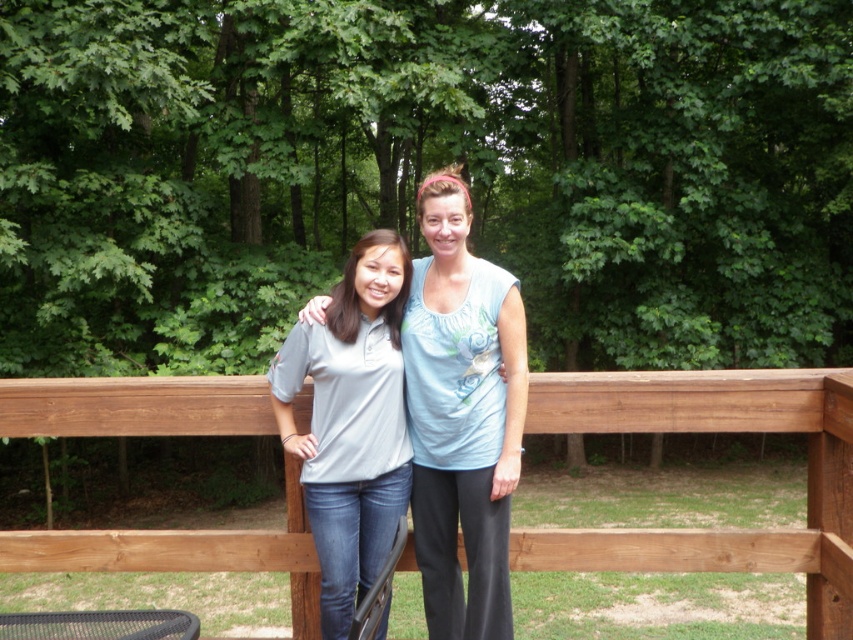
Question: Does brown wooden fence at center appear on the left side of light blue cotton shirt at center?

Choices:
 (A) yes
 (B) no

Answer: (B)

Question: Which point appears farthest from the camera in this image?

Choices:
 (A) (347, 627)
 (B) (585, 420)
 (C) (459, 570)

Answer: (C)

Question: Which point is farther to the camera?

Choices:
 (A) matte gray shirt at center
 (B) brown wooden fence at center
 (C) light blue cotton shirt at center

Answer: (C)

Question: Observing the image, what is the correct spatial positioning of brown wooden fence at center in reference to light blue cotton shirt at center?

Choices:
 (A) right
 (B) left

Answer: (A)

Question: Does light blue cotton shirt at center have a lesser width compared to matte gray shirt at center?

Choices:
 (A) yes
 (B) no

Answer: (A)

Question: Which object is the closest to the matte gray shirt at center?

Choices:
 (A) brown wooden fence at center
 (B) light blue cotton shirt at center

Answer: (B)